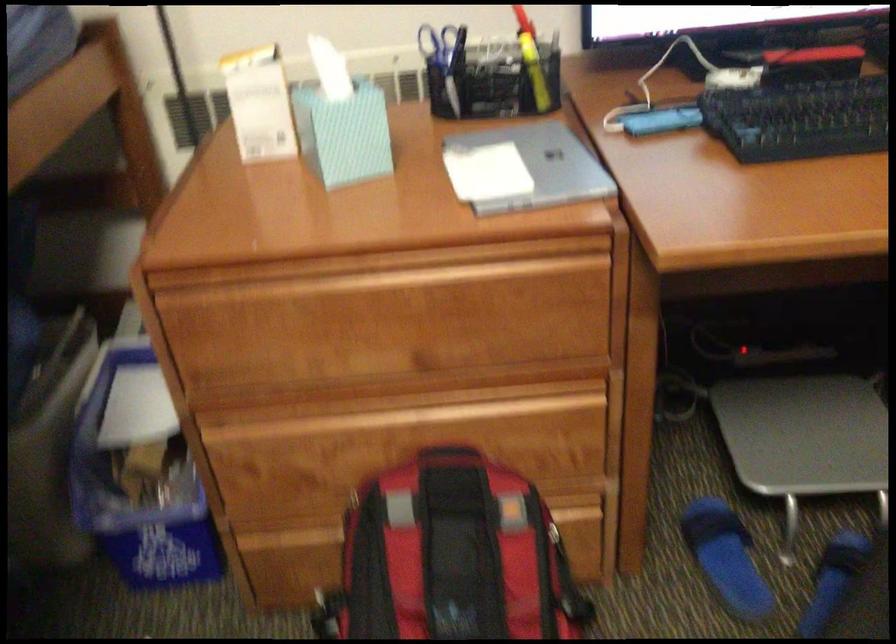
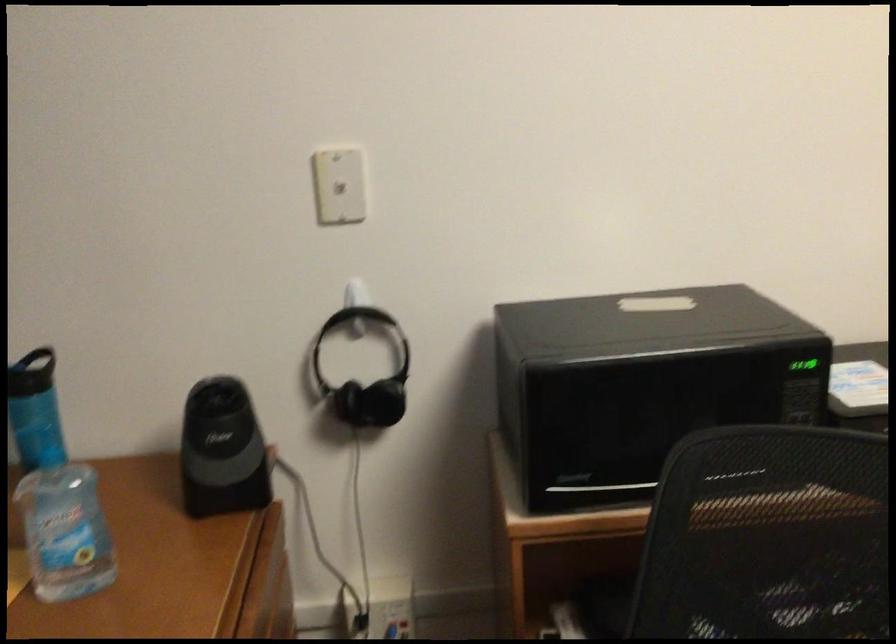
Question: The camera is either moving clockwise (left) or counter-clockwise (right) around the object. The first image is from the beginning of the video and the second image is from the end. Is the camera moving left or right when shooting the video?

Choices:
 (A) Left
 (B) Right

Answer: (A)